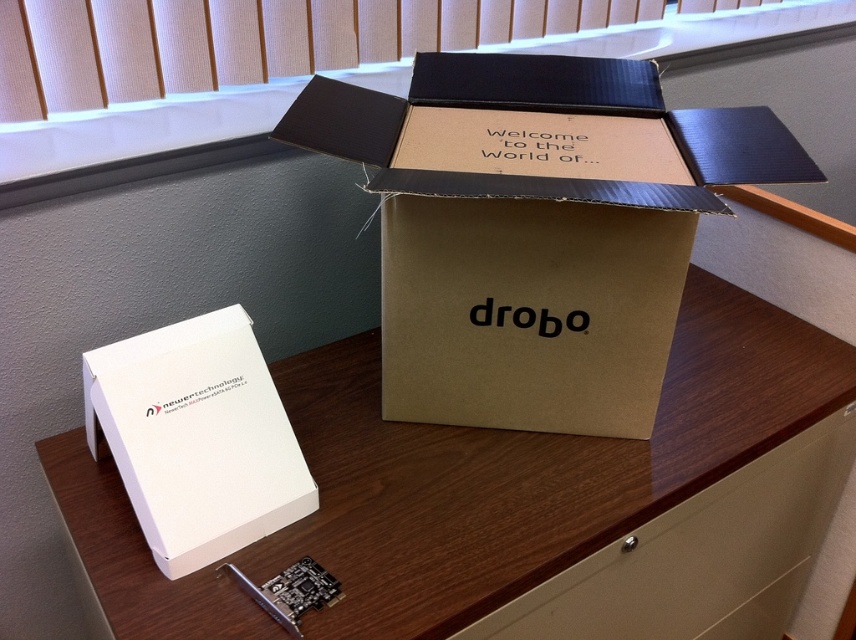
You are holding a 24 inch ruler and want to measure the distance between yourself and the white cardboard box at center. Can you reach the box with your ruler without moving?

The distance between you and the white cardboard box at center is 25.92 inches. Since your ruler is only 24 inches long, you cannot reach the box with it without moving closer.